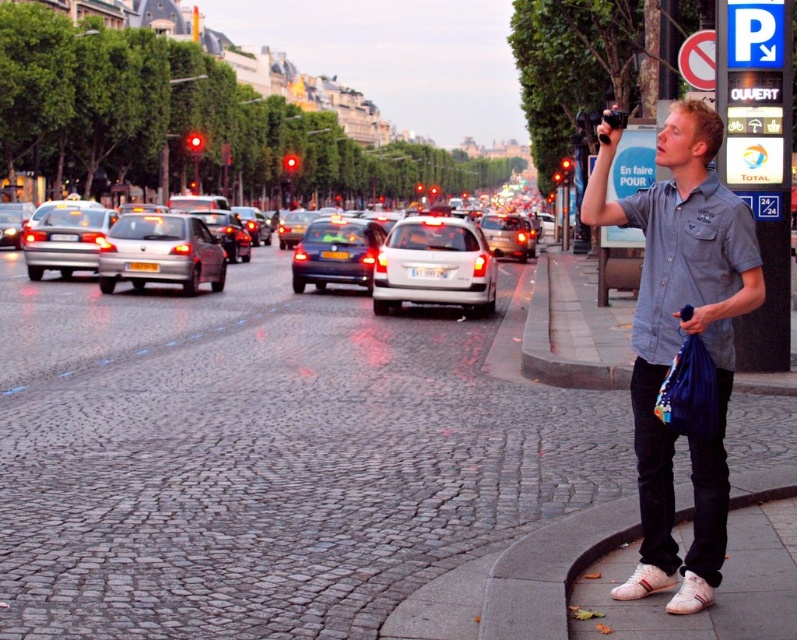
Which is more to the left, silver metallic sedan at center or matte silver sedan at center?

silver metallic sedan at center is more to the left.

Can you confirm if silver metallic sedan at center is wider than matte silver sedan at center?

Indeed, silver metallic sedan at center has a greater width compared to matte silver sedan at center.

Find the location of `silver metallic sedan at center`. silver metallic sedan at center is located at coordinates (398, 259).

Who is more distant from viewer, (442,243) or (187,230)?

The point (187,230) is more distant.

This screenshot has width=797, height=640. Find the location of `silver metallic sedan at center`. silver metallic sedan at center is located at coordinates (398, 259).

Who is taller, white matte hatchback at center or shiny silver sedan at center?

With more height is shiny silver sedan at center.

Can you confirm if white matte hatchback at center is positioned to the left of shiny silver sedan at center?

Incorrect, white matte hatchback at center is not on the left side of shiny silver sedan at center.

The image size is (797, 640). Describe the element at coordinates (434, 266) in the screenshot. I see `white matte hatchback at center` at that location.

Where is `white matte hatchback at center`? The image size is (797, 640). white matte hatchback at center is located at coordinates (434, 266).